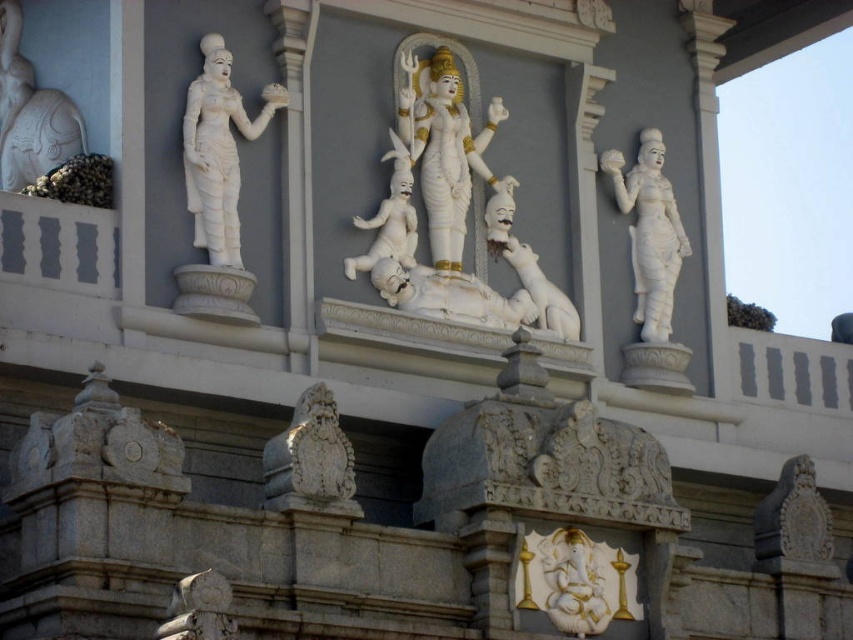
Measure the distance between white stone elephant at upper left and camera.

69.32 meters

Find the location of a particular element. The width and height of the screenshot is (853, 640). white stone elephant at upper left is located at coordinates (30, 113).

Who is taller, white stone elephant at upper left or carved stone lion at center?

Standing taller between the two is white stone elephant at upper left.

Can you confirm if white stone elephant at upper left is shorter than carved stone lion at center?

In fact, white stone elephant at upper left may be taller than carved stone lion at center.

What do you see at coordinates (30, 113) in the screenshot?
I see `white stone elephant at upper left` at bounding box center [30, 113].

Locate an element on the screen. The height and width of the screenshot is (640, 853). white stone elephant at upper left is located at coordinates (30, 113).

Does white marble statue at right appear on the left side of white stone elephant at upper left?

Incorrect, white marble statue at right is not on the left side of white stone elephant at upper left.

Describe the element at coordinates (648, 232) in the screenshot. I see `white marble statue at right` at that location.

In order to click on white marble statue at right in this screenshot , I will do `click(648, 232)`.

Where is `white marble statue at right`? This screenshot has width=853, height=640. white marble statue at right is located at coordinates (648, 232).